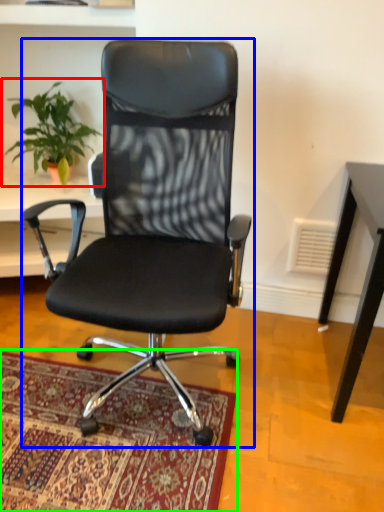
Question: Which object is positioned farthest from houseplant (highlighted by a red box)? Select from chair (highlighted by a blue box) and mat (highlighted by a green box).

Choices:
 (A) chair
 (B) mat

Answer: (B)